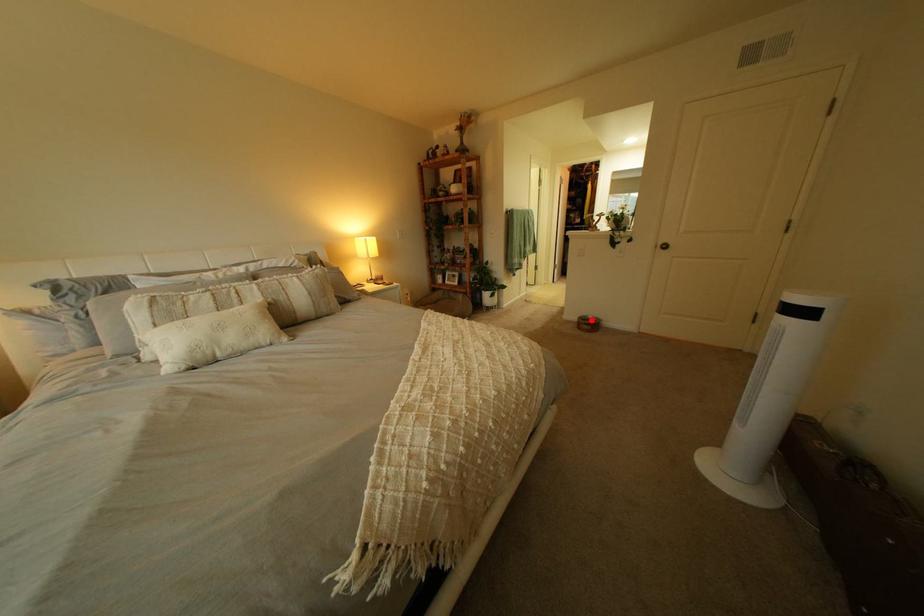
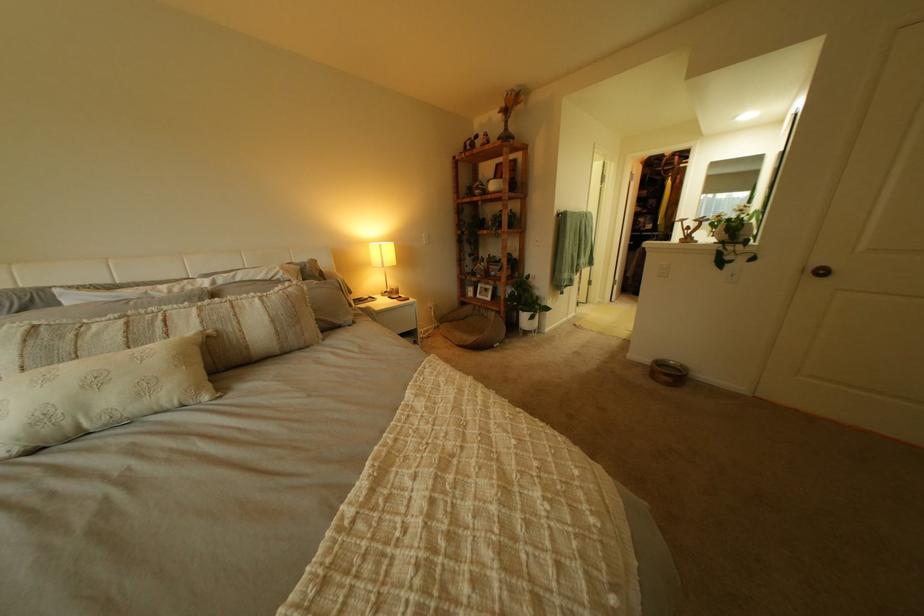
Question: A red point is marked in image1. In image2, is the corresponding 3D point closer to the camera or farther? Reply with the corresponding letter.

Choices:
 (A) The corresponding 3D point is closer.
 (B) The corresponding 3D point is farther.

Answer: (B)